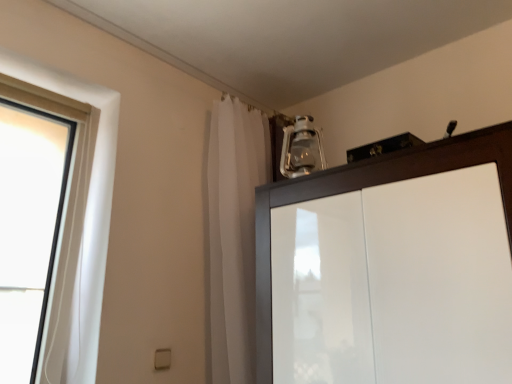
Question: Is clear glass lantern at upper center taller than white sheer curtain at upper center?

Choices:
 (A) no
 (B) yes

Answer: (A)

Question: Is clear glass lantern at upper center located outside white sheer curtain at upper center?

Choices:
 (A) no
 (B) yes

Answer: (B)

Question: Does clear glass lantern at upper center appear on the left side of white sheer curtain at upper center?

Choices:
 (A) yes
 (B) no

Answer: (B)

Question: Can you confirm if clear glass lantern at upper center is positioned to the right of white sheer curtain at upper center?

Choices:
 (A) yes
 (B) no

Answer: (A)

Question: From the image's perspective, does clear glass lantern at upper center appear higher than white sheer curtain at upper center?

Choices:
 (A) yes
 (B) no

Answer: (A)

Question: Is glossy wood cupboard at upper right to the left or to the right of white sheer curtain at upper center in the image?

Choices:
 (A) left
 (B) right

Answer: (B)

Question: From the image's perspective, is glossy wood cupboard at upper right positioned above or below white sheer curtain at upper center?

Choices:
 (A) below
 (B) above

Answer: (A)

Question: Is glossy wood cupboard at upper right wider or thinner than white sheer curtain at upper center?

Choices:
 (A) wide
 (B) thin

Answer: (A)

Question: In terms of height, does glossy wood cupboard at upper right look taller or shorter compared to white sheer curtain at upper center?

Choices:
 (A) tall
 (B) short

Answer: (B)

Question: From the image's perspective, is clear glass lantern at upper center positioned above or below white sheer curtain at upper center?

Choices:
 (A) above
 (B) below

Answer: (A)

Question: In the image, is clear glass lantern at upper center positioned in front of or behind white sheer curtain at upper center?

Choices:
 (A) front
 (B) behind

Answer: (B)

Question: Considering the positions of clear glass lantern at upper center and white sheer curtain at upper center in the image, is clear glass lantern at upper center bigger or smaller than white sheer curtain at upper center?

Choices:
 (A) big
 (B) small

Answer: (B)

Question: From a real-world perspective, is clear glass lantern at upper center above or below white sheer curtain at upper center?

Choices:
 (A) above
 (B) below

Answer: (A)

Question: From their relative heights in the image, would you say white sheer curtain at upper center is taller or shorter than clear glass lantern at upper center?

Choices:
 (A) short
 (B) tall

Answer: (B)

Question: From the image's perspective, relative to clear glass lantern at upper center, is white sheer curtain at upper center above or below?

Choices:
 (A) below
 (B) above

Answer: (A)